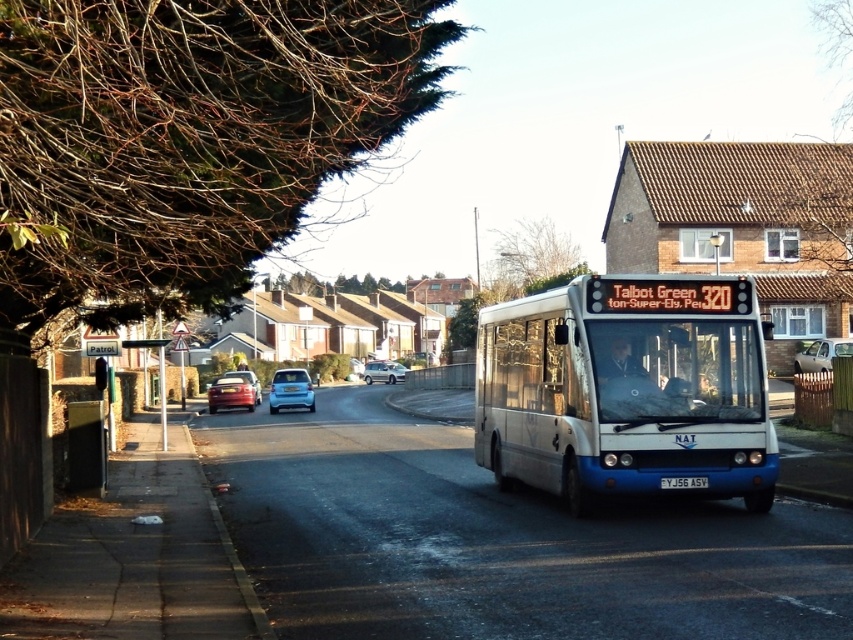
Question: Based on their relative distances, which object is farther from the light blue metallic hatchback at center?

Choices:
 (A) metallic pole at left
 (B) yellowmetalliclicense plate at center
 (C) green leafy tree at upper center

Answer: (C)

Question: Considering the relative positions of light blue metallic hatchback at center and metallic red car at center in the image provided, where is light blue metallic hatchback at center located with respect to metallic red car at center?

Choices:
 (A) right
 (B) left

Answer: (A)

Question: Which of the following is the closest to the observer?

Choices:
 (A) metallic silver car at center
 (B) brown leafless branches at upper left
 (C) green leafy tree at upper center

Answer: (B)

Question: Which object is farther from the camera taking this photo?

Choices:
 (A) light blue metallic hatchback at center
 (B) metallic silver car at center

Answer: (B)

Question: Does light blue metallic hatchback at center have a larger size compared to metallic red car at center?

Choices:
 (A) yes
 (B) no

Answer: (A)

Question: Can you confirm if white metallic bus at center is thinner than green leafy tree at upper center?

Choices:
 (A) yes
 (B) no

Answer: (A)